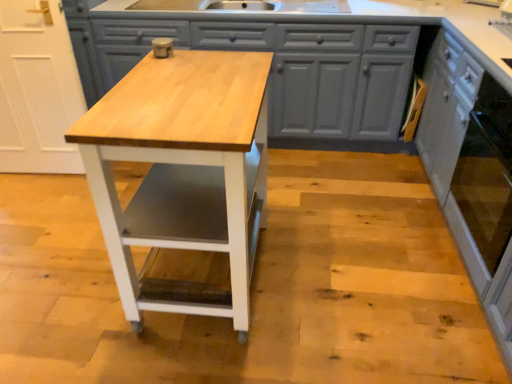
Locate an element on the screen. The width and height of the screenshot is (512, 384). vacant space situated above natural wood table at center (from a real-world perspective) is located at coordinates (189, 89).